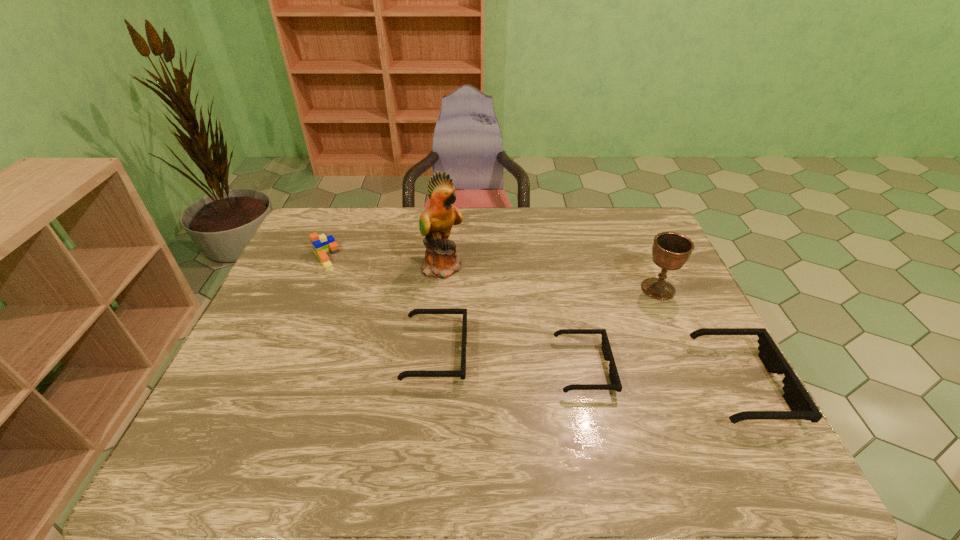
At what (x,y) coordinates should I click in order to perform the action: click on vacant space at the far edge of the desktop. Please return your answer as a coordinate pair (x, y). The height and width of the screenshot is (540, 960). Looking at the image, I should click on (544, 242).

Where is `vacant region at the near edge of the desktop`? The width and height of the screenshot is (960, 540). vacant region at the near edge of the desktop is located at coordinates (497, 416).

Find the location of a particular element. free space at the left edge of the desktop is located at coordinates (264, 363).

The image size is (960, 540). In the image, there is a desktop. Find the location of `vacant region at the far left corner`. vacant region at the far left corner is located at coordinates (351, 214).

You are a GUI agent. You are given a task and a screenshot of the screen. Output one action in this format:
    pyautogui.click(x=<x>, y=<y>)
    Task: Click on the vacant space at the near right corner of the desktop
    This screenshot has height=540, width=960.
    Given the screenshot: What is the action you would take?
    pyautogui.click(x=704, y=422)

Find the location of a particular element. This screenshot has height=540, width=960. vacant region between the fifth tallest object and the second sunglasses from right to left is located at coordinates (510, 360).

In order to click on free space between the fifth tallest object and the rightmost sunglasses in this screenshot , I will do `click(588, 368)`.

Identify the location of empty space that is in between the rightmost sunglasses and the fifth shortest object. Image resolution: width=960 pixels, height=540 pixels. (700, 336).

Locate an element on the screen. This screenshot has width=960, height=540. free space between the rightmost sunglasses and the second sunglasses from right to left is located at coordinates (662, 376).

Where is `free space between the rightmost sunglasses and the second shortest sunglasses`? Image resolution: width=960 pixels, height=540 pixels. free space between the rightmost sunglasses and the second shortest sunglasses is located at coordinates (588, 368).